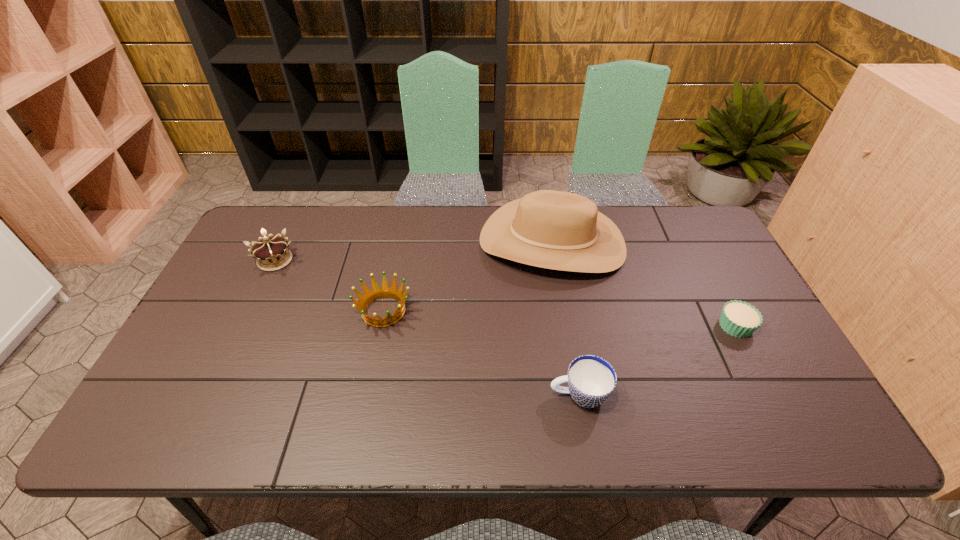
Identify the location of cowboy hat. This screenshot has width=960, height=540. (551, 229).

At what (x,y) coordinates should I click in order to perform the action: click on the taller crown. Please return your answer as a coordinate pair (x, y). The image size is (960, 540). Looking at the image, I should click on (270, 252).

This screenshot has width=960, height=540. In order to click on the farther crown in this screenshot , I will do `click(270, 252)`.

At what (x,y) coordinates should I click in order to perform the action: click on the nearest object. Please return your answer as a coordinate pair (x, y). Image resolution: width=960 pixels, height=540 pixels. Looking at the image, I should click on (591, 380).

Locate an element on the screen. The image size is (960, 540). the second object from left to right is located at coordinates (384, 292).

Locate an element on the screen. The image size is (960, 540). the right crown is located at coordinates (384, 292).

The width and height of the screenshot is (960, 540). Identify the location of the shortest object. (740, 319).

Image resolution: width=960 pixels, height=540 pixels. Find the location of `the rightmost object`. the rightmost object is located at coordinates (740, 319).

This screenshot has width=960, height=540. In order to click on free space located on the front of the cowboy hat in this screenshot , I will do `click(567, 329)`.

What are the coordinates of `vacant space located on the back of the taller crown` in the screenshot? It's located at tap(294, 222).